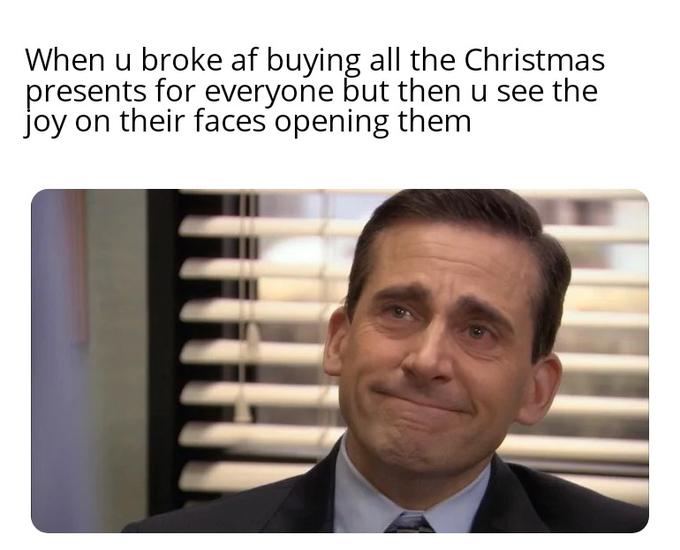
At what (x,y) coordinates should I click in order to perform the action: click on blind pull. Please return your answer as a coordinate pair (x, y). Looking at the image, I should click on (239, 293), (253, 264).